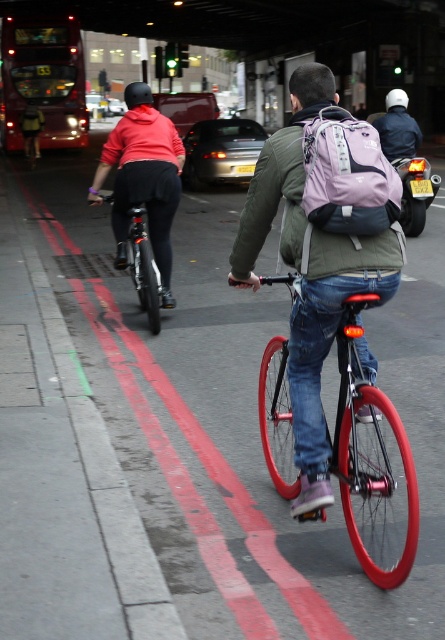
You are a pedestrian standing at the edge of the bike lane. You see the green matte jacket at center and the matte black helmet at upper left. Which object is closer to you?

The green matte jacket at center is closer to you because it is in front of the matte black helmet at upper left.

You are a city planner analyzing this image to improve bike lane safety. You need to determine the exact location of the matte black helmet at upper left in the image. What are its coordinates?

The matte black helmet at upper left is located at coordinates point (142, 177).